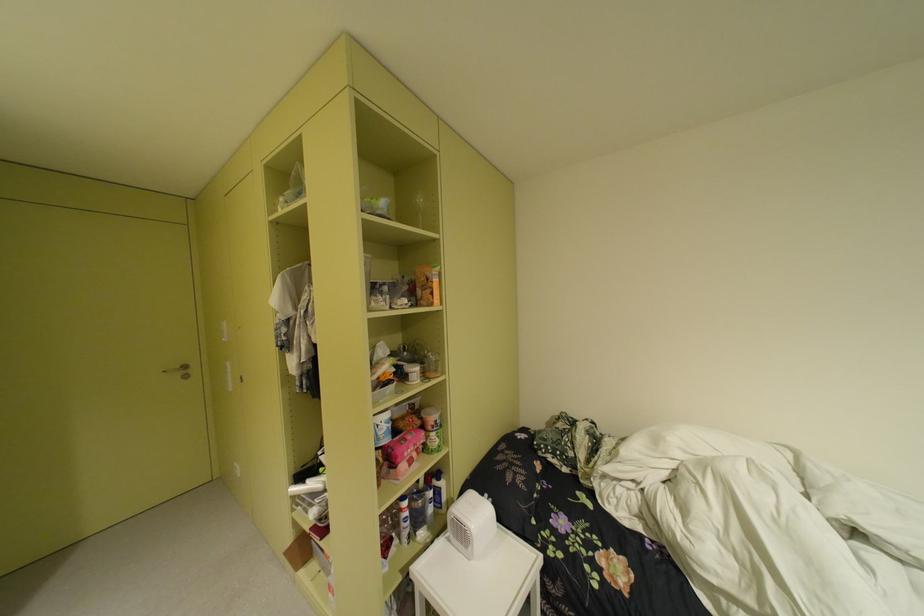
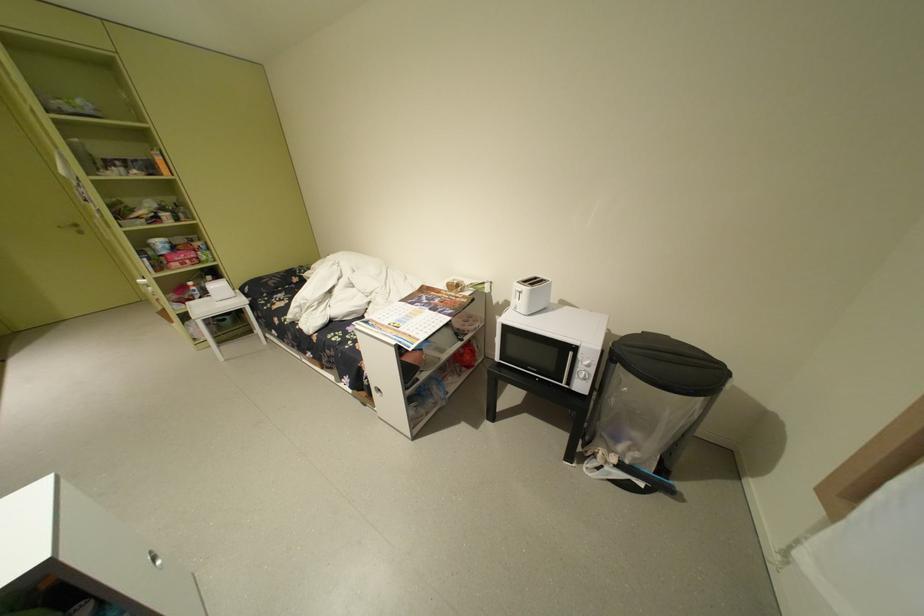
The point at (419,507) is marked in the first image. Where is the corresponding point in the second image?

(204, 286)